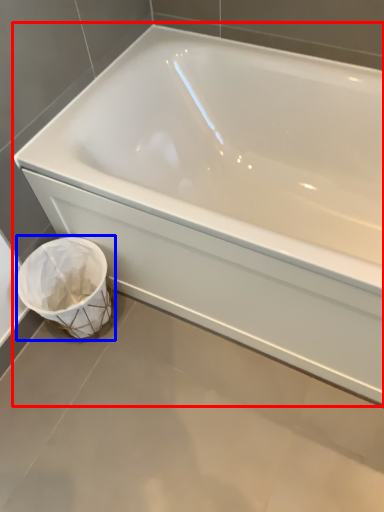
Question: Which object appears closest to the camera in this image, bathtub (highlighted by a red box) or toilet bowl (highlighted by a blue box)?

Choices:
 (A) bathtub
 (B) toilet bowl

Answer: (A)